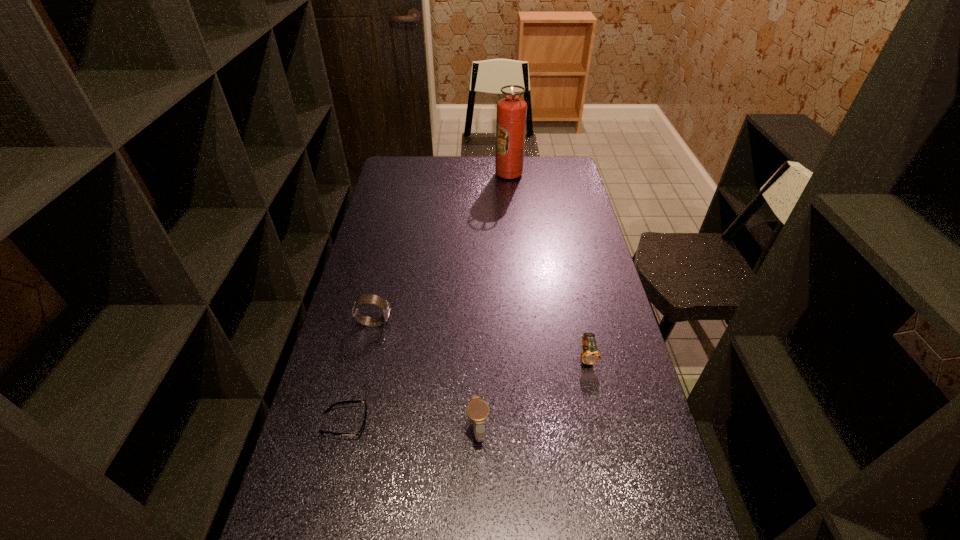
Image resolution: width=960 pixels, height=540 pixels. In order to click on free space that satisfies the following two spatial constraints: 1. on the face of the rightmost watch; 2. on the front-facing side of the shortest object in this screenshot , I will do `click(601, 423)`.